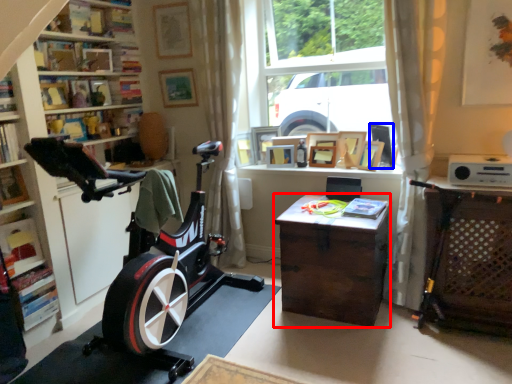
Question: Which of the following is the closest to the observer, desk (highlighted by a red box) or picture frame (highlighted by a blue box)?

Choices:
 (A) desk
 (B) picture frame

Answer: (A)